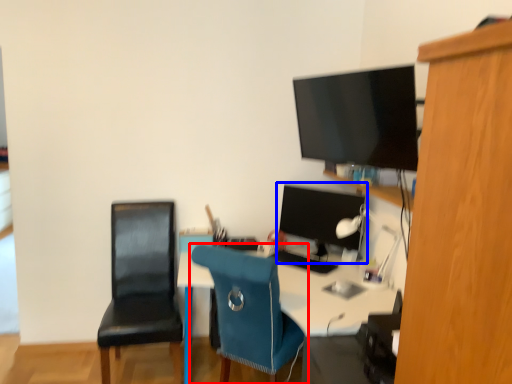
Question: Which object is closer to the camera taking this photo, chair (highlighted by a red box) or computer monitor (highlighted by a blue box)?

Choices:
 (A) chair
 (B) computer monitor

Answer: (A)